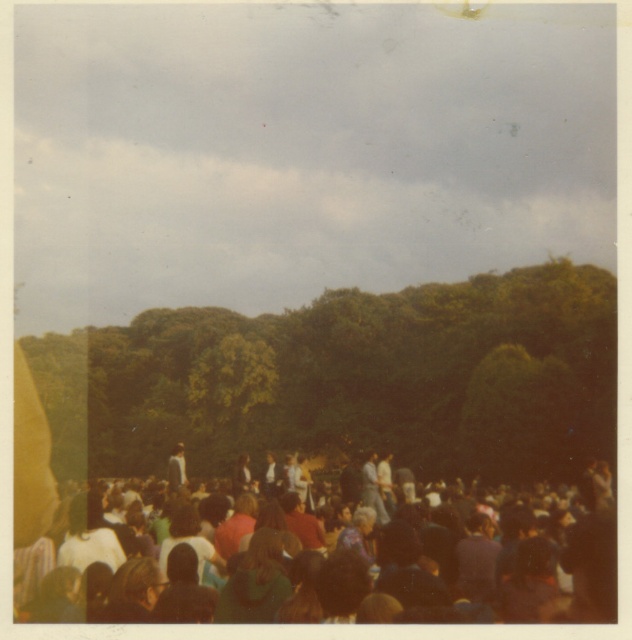
Consider the image. Can you confirm if green leafy tree at center is positioned to the left of multicolored fabric crowd at lower center?

Correct, you'll find green leafy tree at center to the left of multicolored fabric crowd at lower center.

How much distance is there between green leafy tree at center and multicolored fabric crowd at lower center?

green leafy tree at center and multicolored fabric crowd at lower center are 105.27 feet apart from each other.

Is point (574, 352) less distant than point (408, 621)?

No, (574, 352) is further to viewer.

The width and height of the screenshot is (632, 640). In order to click on green leafy tree at center in this screenshot , I will do `click(349, 380)`.